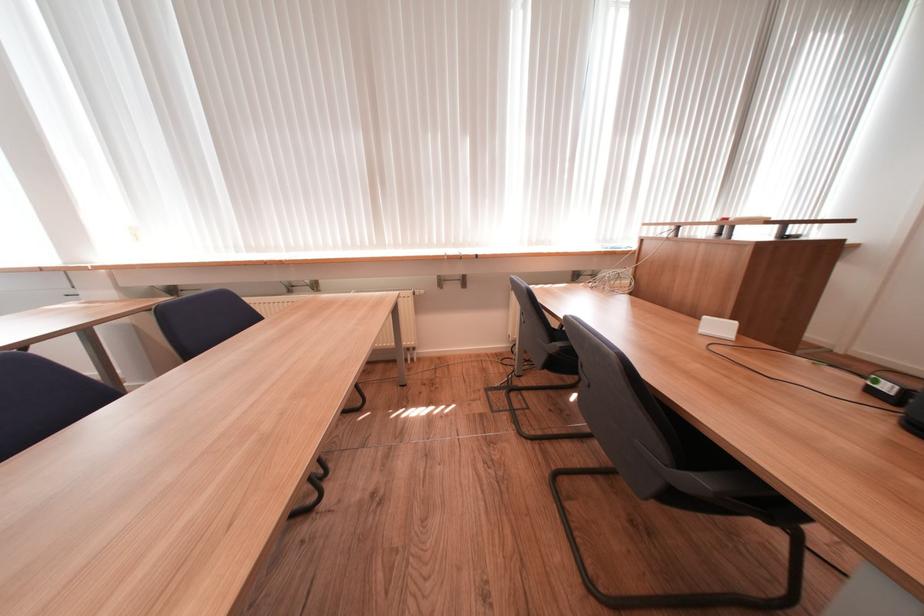
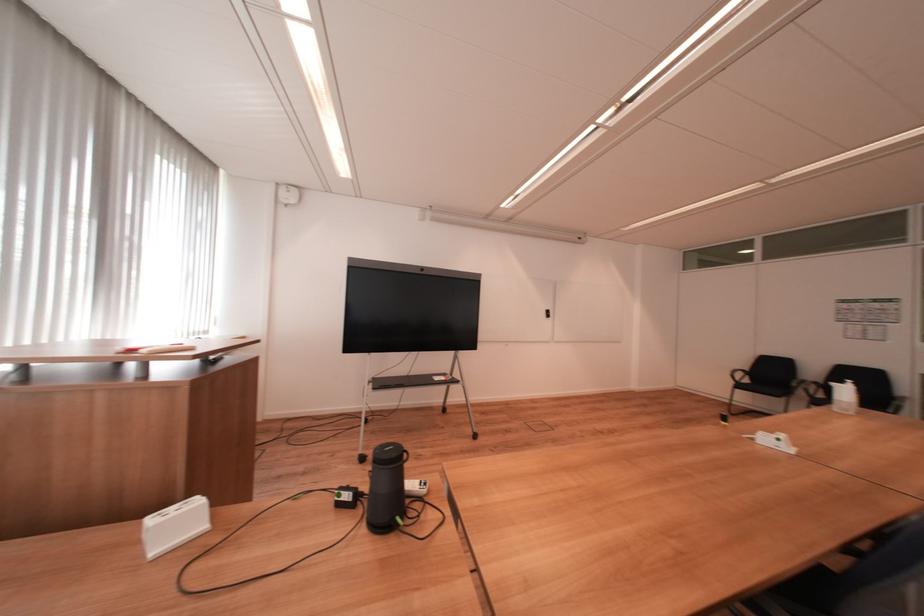
Question: Based on the continuous images, in which direction is the camera rotating? Reply with the corresponding letter.

Choices:
 (A) Left
 (B) Right
 (C) Up
 (D) Down

Answer: (B)